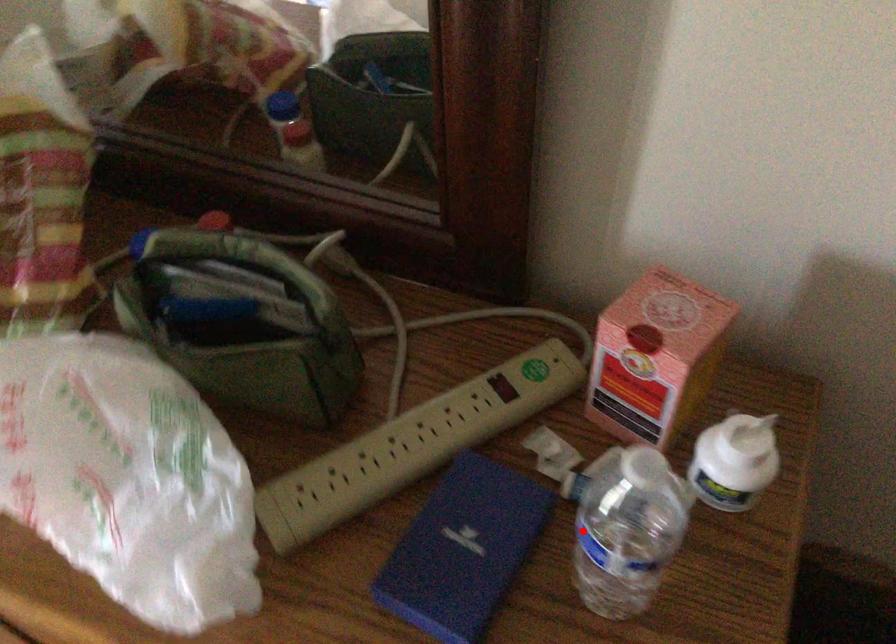
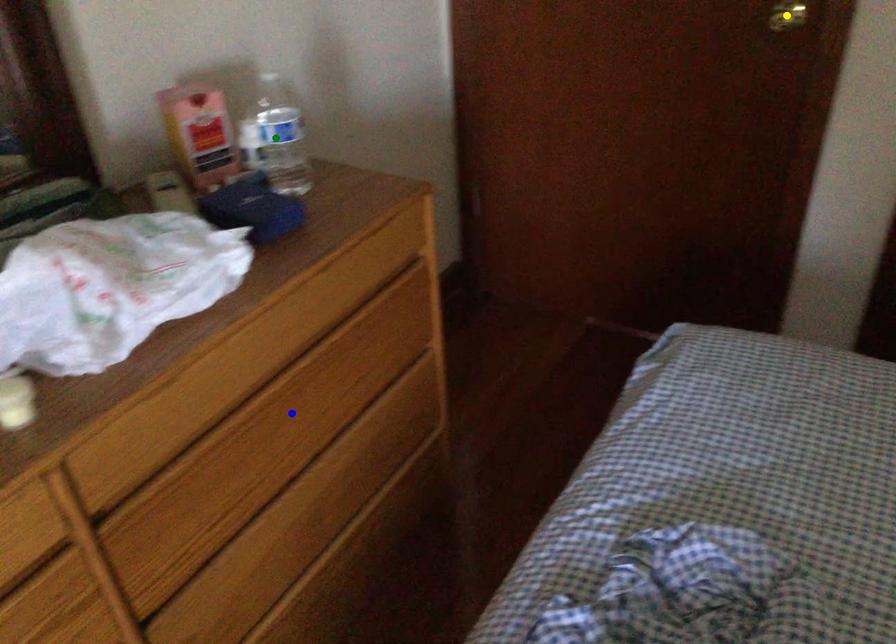
Question: I am providing you with two images of the same scene from different viewpoints. A red point is marked on the first image. You are given multiple points on the second image. Which mark in image 2 goes with the point in image 1?

Choices:
 (A) yellow point
 (B) green point
 (C) blue point

Answer: (B)